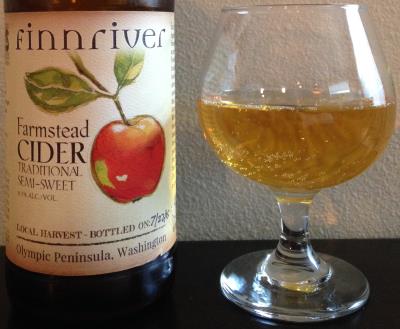
Find the location of a particular element. glass is located at coordinates (275, 45).